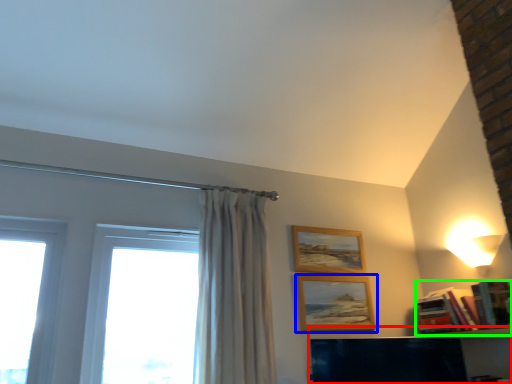
Question: Based on their relative distances, which object is nearer to shelf (highlighted by a red box)? Choose from picture frame (highlighted by a blue box) and book (highlighted by a green box).

Choices:
 (A) picture frame
 (B) book

Answer: (B)